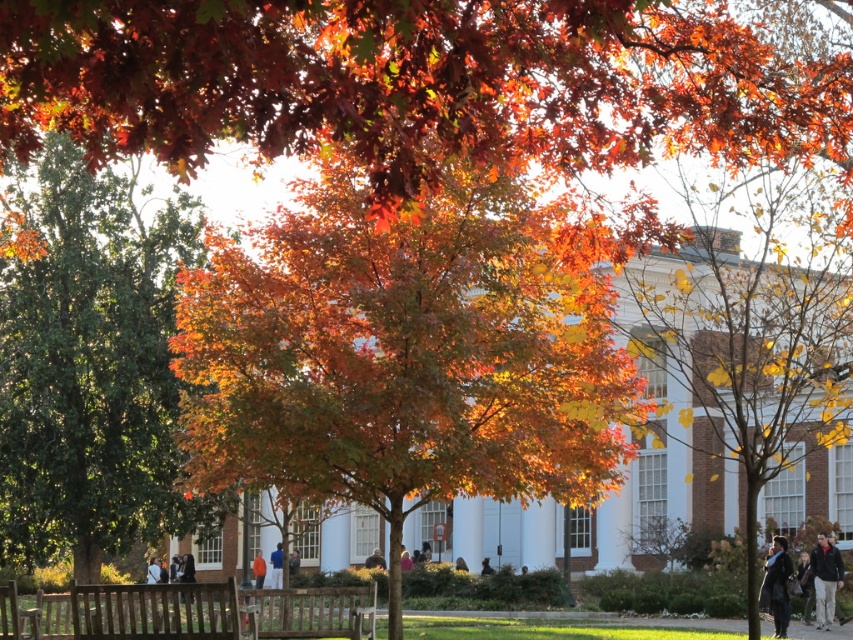
Question: Is dark gray sweater at lower right further to camera compared to orange fabric at center?

Choices:
 (A) yes
 (B) no

Answer: (B)

Question: Is shiny green tree at center wider than orange shirt at center?

Choices:
 (A) yes
 (B) no

Answer: (A)

Question: Among these points, which one is farthest from the camera?

Choices:
 (A) (583, 250)
 (B) (824, 589)
 (C) (15, 541)

Answer: (C)

Question: Can you confirm if golden-brown bark tree at right is positioned to the right of dark gray sweater at lower right?

Choices:
 (A) no
 (B) yes

Answer: (A)

Question: Among these points, which one is nearest to the camera?

Choices:
 (A) pos(258,563)
 (B) pos(73,163)
 (C) pos(581,480)

Answer: (C)

Question: Estimate the real-world distances between objects in this image. Which object is farther from the dark gray sweater at lower right?

Choices:
 (A) golden-brown bark tree at right
 (B) orange leafy tree at center

Answer: (B)